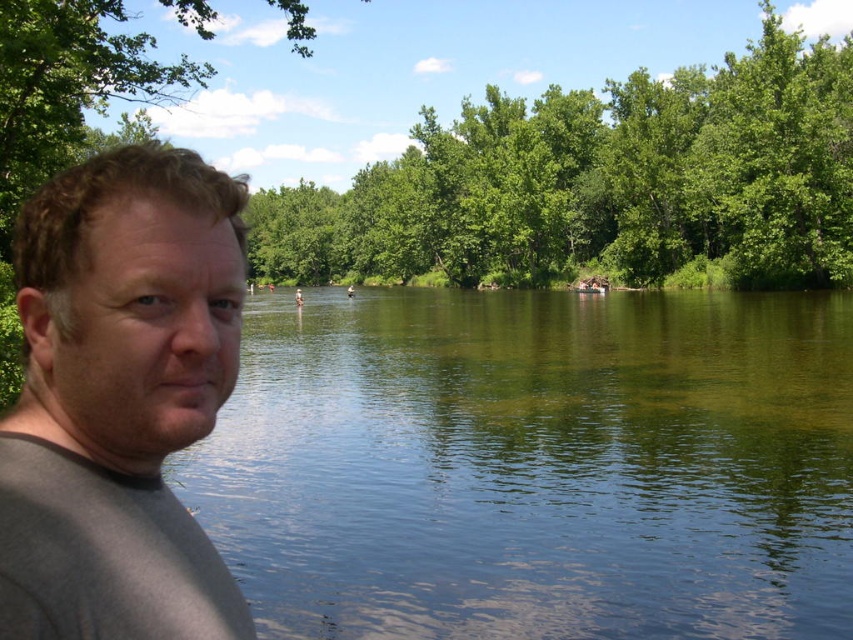
Question: Which object appears farthest from the camera in this image?

Choices:
 (A) green leafy trees at center
 (B) gray matte shirt at left

Answer: (A)

Question: Can you confirm if green reflective water at center is positioned to the left of gray matte shirt at left?

Choices:
 (A) yes
 (B) no

Answer: (B)

Question: Can you confirm if green reflective water at center is bigger than green leafy trees at center?

Choices:
 (A) yes
 (B) no

Answer: (B)

Question: Can you confirm if green reflective water at center is positioned to the right of gray matte shirt at left?

Choices:
 (A) yes
 (B) no

Answer: (A)

Question: Which point is closer to the camera?

Choices:
 (A) green reflective water at center
 (B) gray matte shirt at left

Answer: (B)

Question: Which point is farther from the camera taking this photo?

Choices:
 (A) (457, 172)
 (B) (709, 310)
 (C) (100, 285)

Answer: (A)